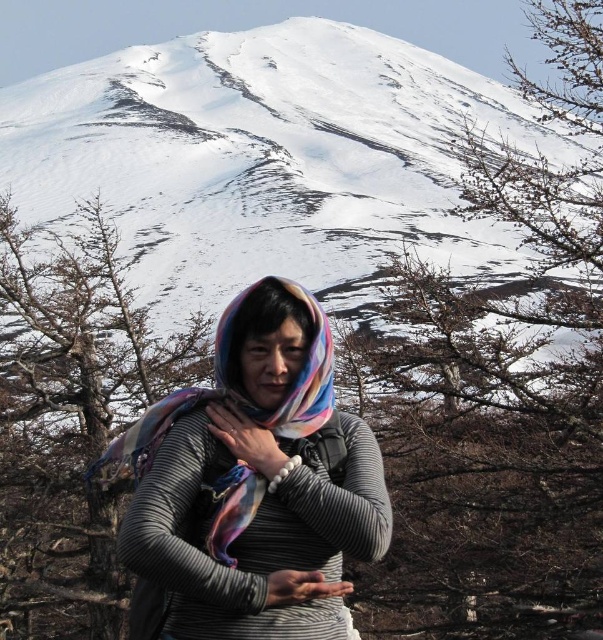
Question: Can you confirm if snowy white mountain at upper center is thinner than multicolored scarf at center?

Choices:
 (A) yes
 (B) no

Answer: (B)

Question: Is snowy white mountain at upper center above multicolored scarf at center?

Choices:
 (A) yes
 (B) no

Answer: (A)

Question: Can you confirm if snowy white mountain at upper center is bigger than multicolored scarf at center?

Choices:
 (A) yes
 (B) no

Answer: (A)

Question: Which point is farther to the camera?

Choices:
 (A) (285, 189)
 (B) (259, 406)

Answer: (A)

Question: Which object is closer to the camera taking this photo?

Choices:
 (A) multicolored scarf at center
 (B) snowy white mountain at upper center

Answer: (A)